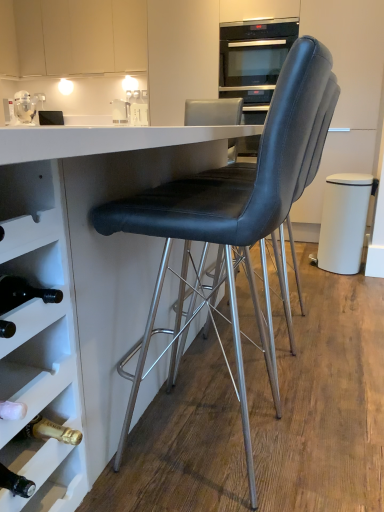
You are a GUI agent. You are given a task and a screenshot of the screen. Output one action in this format:
    pyautogui.click(x=<x>, y=<y>)
    Task: Click on the vacant space in front of white matte trash can at right
    
    Given the screenshot: What is the action you would take?
    pyautogui.click(x=345, y=281)